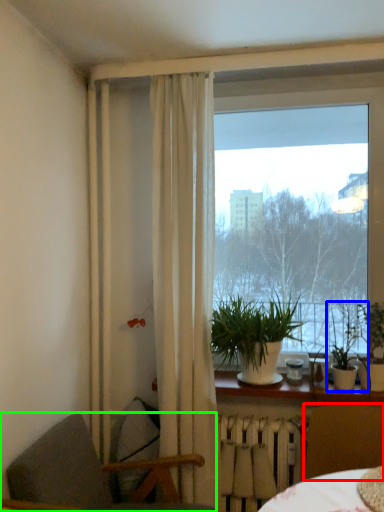
Question: Which is nearer to the chair (highlighted by a red box)? houseplant (highlighted by a blue box) or chair (highlighted by a green box).

Choices:
 (A) houseplant
 (B) chair

Answer: (A)